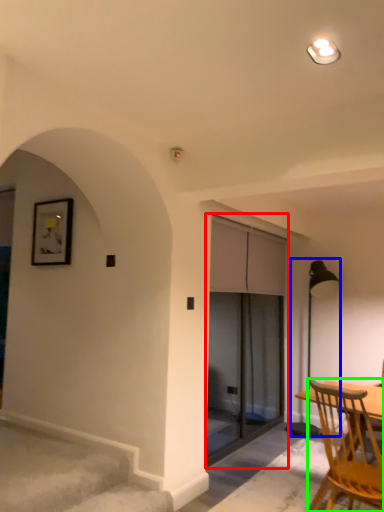
Question: Which is farther away from screen door (highlighted by a red box)? lamp (highlighted by a blue box) or chair (highlighted by a green box)?

Choices:
 (A) lamp
 (B) chair

Answer: (B)